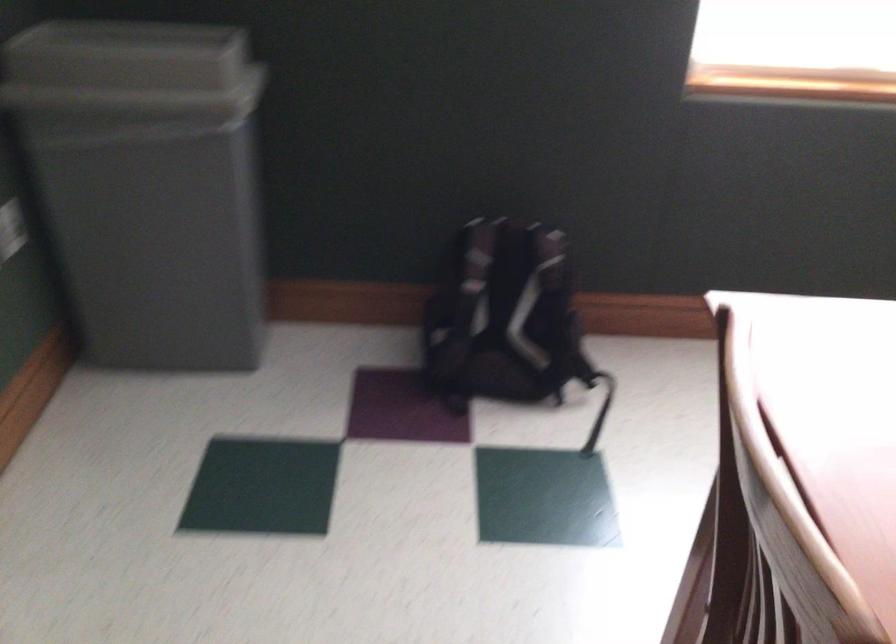
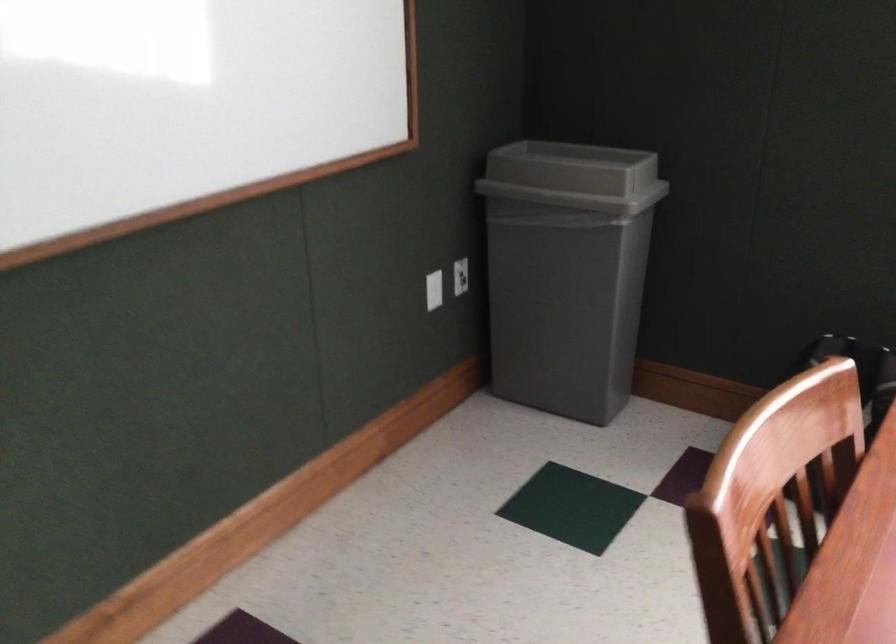
Question: The camera is either moving clockwise (left) or counter-clockwise (right) around the object. The first image is from the beginning of the video and the second image is from the end. Is the camera moving left or right when shooting the video?

Choices:
 (A) Left
 (B) Right

Answer: (B)